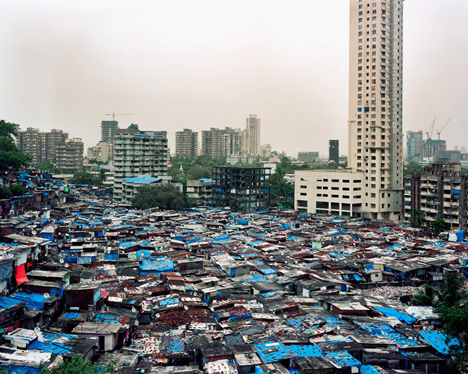
Find the location of a particular element. homes is located at coordinates (111, 342).